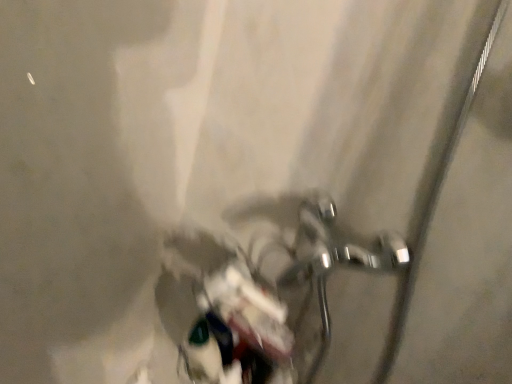
Describe the element at coordinates (260, 288) in the screenshot. I see `metallic silver bicycle at center` at that location.

Find the location of a particular element. The image size is (512, 384). metallic silver bicycle at center is located at coordinates (260, 288).

Locate an element on the screen. The height and width of the screenshot is (384, 512). metallic silver bicycle at center is located at coordinates (260, 288).